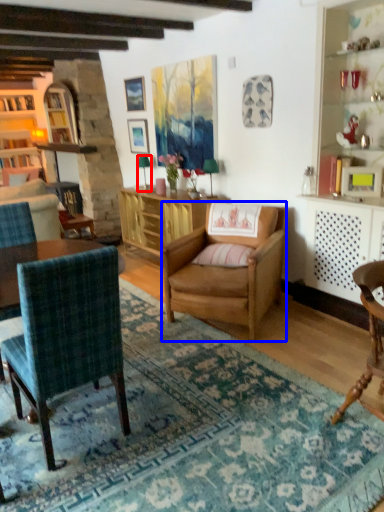
Question: Among these objects, which one is farthest to the camera, lamp (highlighted by a red box) or chair (highlighted by a blue box)?

Choices:
 (A) lamp
 (B) chair

Answer: (A)